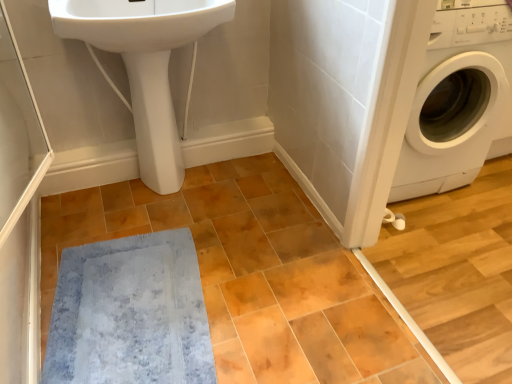
Question: Is there a large distance between blue plush bath mat at lower left and white glossy sink at upper left?

Choices:
 (A) no
 (B) yes

Answer: (A)

Question: Is the depth of blue plush bath mat at lower left less than that of white glossy sink at upper left?

Choices:
 (A) no
 (B) yes

Answer: (B)

Question: Is blue plush bath mat at lower left outside of white glossy sink at upper left?

Choices:
 (A) no
 (B) yes

Answer: (B)

Question: Is blue plush bath mat at lower left to the left of white glossy sink at upper left from the viewer's perspective?

Choices:
 (A) no
 (B) yes

Answer: (B)

Question: From the image's perspective, does blue plush bath mat at lower left appear lower than white glossy sink at upper left?

Choices:
 (A) no
 (B) yes

Answer: (B)

Question: In terms of width, does blue plush bath mat at lower left look wider or thinner when compared to white glossy washing machine at right?

Choices:
 (A) wide
 (B) thin

Answer: (B)

Question: Looking at the image, does blue plush bath mat at lower left seem bigger or smaller compared to white glossy washing machine at right?

Choices:
 (A) small
 (B) big

Answer: (A)

Question: In terms of height, does blue plush bath mat at lower left look taller or shorter compared to white glossy washing machine at right?

Choices:
 (A) tall
 (B) short

Answer: (B)

Question: Does point (193, 339) appear closer or farther from the camera than point (450, 167)?

Choices:
 (A) farther
 (B) closer

Answer: (B)

Question: From the image's perspective, relative to white glossy sink at upper left, is blue plush bath mat at lower left above or below?

Choices:
 (A) above
 (B) below

Answer: (B)

Question: In terms of size, does blue plush bath mat at lower left appear bigger or smaller than white glossy sink at upper left?

Choices:
 (A) big
 (B) small

Answer: (B)

Question: In terms of height, does blue plush bath mat at lower left look taller or shorter compared to white glossy sink at upper left?

Choices:
 (A) tall
 (B) short

Answer: (B)

Question: Is blue plush bath mat at lower left spatially inside white glossy sink at upper left, or outside of it?

Choices:
 (A) inside
 (B) outside

Answer: (B)

Question: Is white glossy sink at upper left in front of or behind white glossy washing machine at right in the image?

Choices:
 (A) front
 (B) behind

Answer: (A)

Question: Is white glossy sink at upper left spatially inside white glossy washing machine at right, or outside of it?

Choices:
 (A) inside
 (B) outside

Answer: (B)